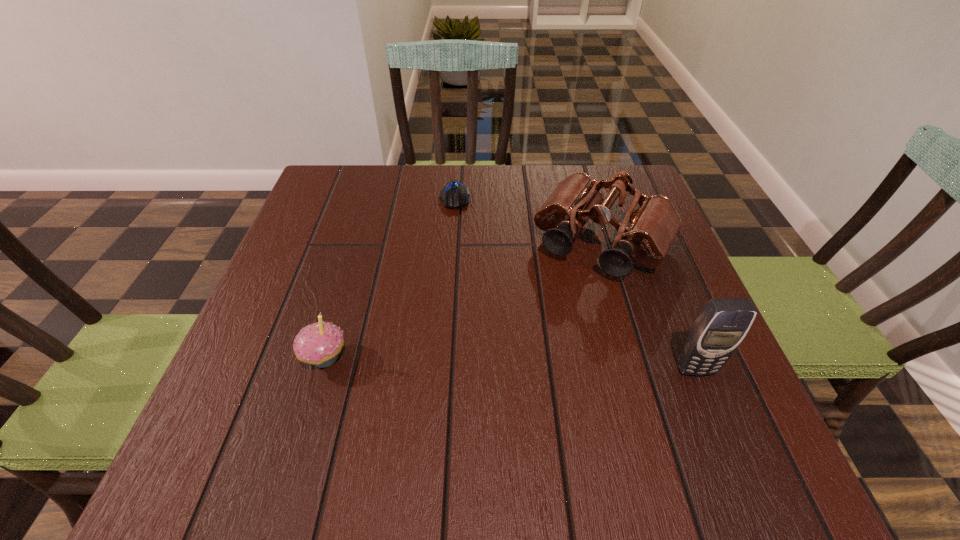
The image size is (960, 540). I want to click on free space at the near right corner of the desktop, so click(709, 419).

Where is `vacant space in between the third object from right to left and the second tallest object`? Image resolution: width=960 pixels, height=540 pixels. vacant space in between the third object from right to left and the second tallest object is located at coordinates (529, 220).

Locate an element on the screen. Image resolution: width=960 pixels, height=540 pixels. free space between the second tallest object and the cupcake is located at coordinates (464, 300).

Identify the location of blank region between the third shortest object and the leftmost object. (464, 300).

This screenshot has height=540, width=960. In order to click on unoccupied position between the cupcake and the computer mouse in this screenshot , I will do pos(390,278).

The image size is (960, 540). I want to click on vacant point located between the third tallest object and the shortest object, so click(390, 278).

The height and width of the screenshot is (540, 960). In order to click on vacant area between the cellular telephone and the leftmost object in this screenshot , I will do `click(510, 363)`.

This screenshot has width=960, height=540. Find the location of `free spot between the binoculars and the tallest object`. free spot between the binoculars and the tallest object is located at coordinates (649, 306).

At what (x,y) coordinates should I click in order to perform the action: click on vacant area between the second object from left to right and the binoculars. Please return your answer as a coordinate pair (x, y). This screenshot has height=540, width=960. Looking at the image, I should click on (529, 220).

You are a GUI agent. You are given a task and a screenshot of the screen. Output one action in this format:
    pyautogui.click(x=<x>, y=<y>)
    Task: Click on the free space between the leftmost object and the tallest object
    This screenshot has height=540, width=960.
    Given the screenshot: What is the action you would take?
    pyautogui.click(x=510, y=363)